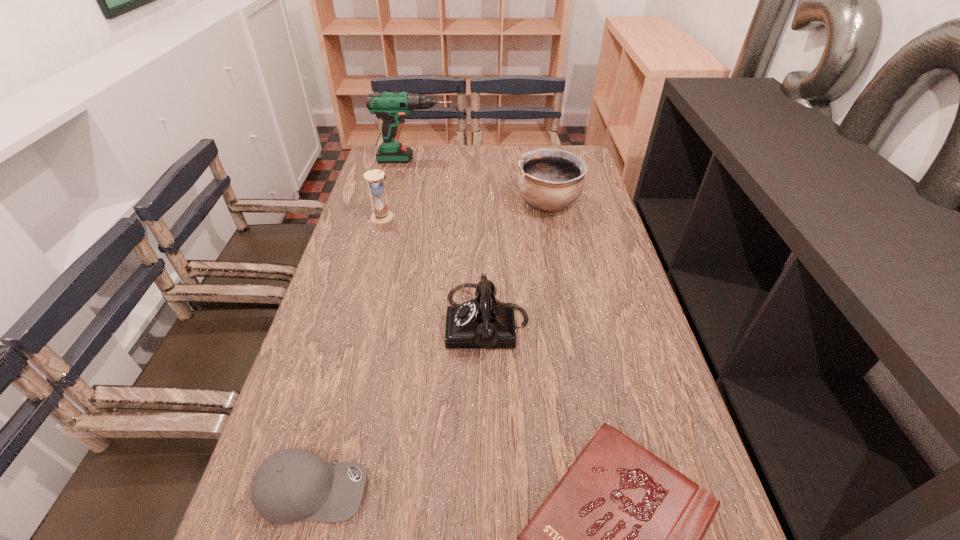
At what (x,y) coordinates should I click in order to perform the action: click on vacant space at the far edge of the desktop. Please return your answer as a coordinate pair (x, y). Looking at the image, I should click on (516, 146).

At what (x,y) coordinates should I click in order to perform the action: click on vacant area at the left edge. Please return your answer as a coordinate pair (x, y). Image resolution: width=960 pixels, height=540 pixels. Looking at the image, I should click on (346, 233).

The height and width of the screenshot is (540, 960). Find the location of `free space at the right edge`. free space at the right edge is located at coordinates (605, 247).

Locate an element on the screen. Image resolution: width=960 pixels, height=540 pixels. vacant space at the far left corner of the desktop is located at coordinates (385, 164).

Where is `empty space that is in between the farthest object and the third nearest object`? The width and height of the screenshot is (960, 540). empty space that is in between the farthest object and the third nearest object is located at coordinates (451, 241).

This screenshot has height=540, width=960. In order to click on empty space that is in between the telephone and the fourth shortest object in this screenshot , I will do `click(517, 263)`.

Image resolution: width=960 pixels, height=540 pixels. In order to click on vacant space in between the drill and the fifth tallest object in this screenshot , I will do `click(364, 325)`.

Where is `vacant area that lies between the hourglass and the fourth tallest object`? vacant area that lies between the hourglass and the fourth tallest object is located at coordinates (435, 270).

Find the location of a particular element. vacant area that lies between the tallest object and the hourglass is located at coordinates (399, 188).

Identify which object is located as the fourth nearest to the hourglass. Please provide its 2D coordinates. Your answer should be formatted as a tuple, i.e. [(x, y)], where the tuple contains the x and y coordinates of a point satisfying the conditions above.

[(291, 485)]